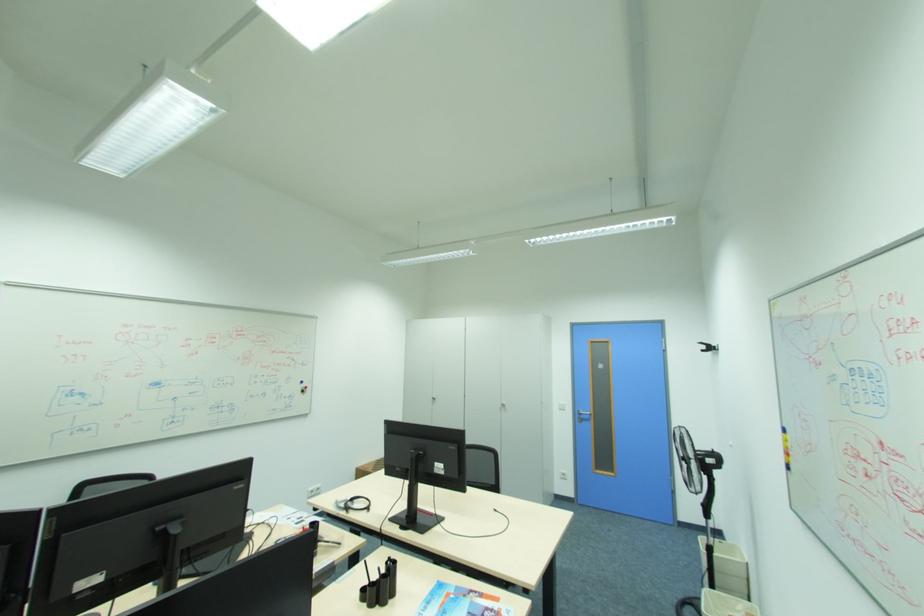
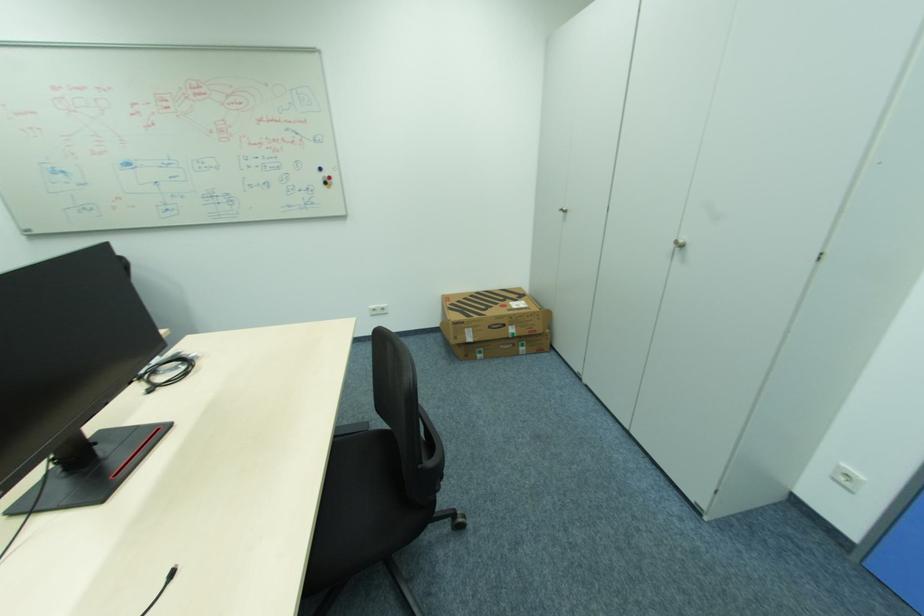
Find the pixel in the second image that matches (309,391) in the first image.

(331, 184)